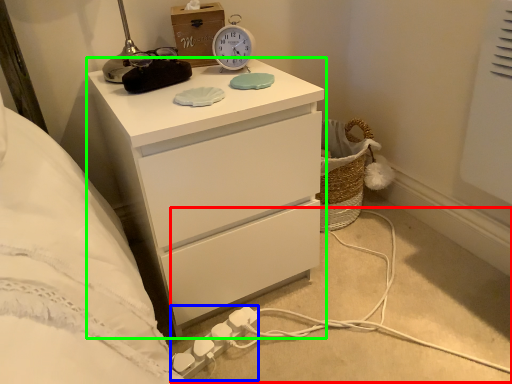
Question: Based on their relative distances, which object is nearer to cable (highlighted by a red box)? Choose from extension cord (highlighted by a blue box) and chest of drawers (highlighted by a green box).

Choices:
 (A) extension cord
 (B) chest of drawers

Answer: (A)